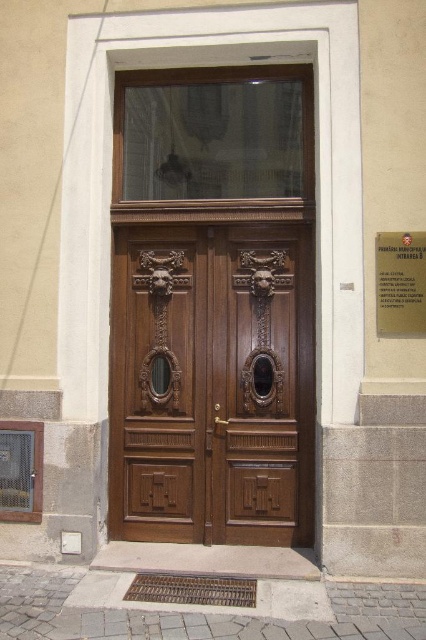
Question: Which point appears farthest from the camera in this image?

Choices:
 (A) (259, 321)
 (B) (416, 244)

Answer: (A)

Question: Does polished wood door at center have a smaller size compared to metallic gold plaque at center?

Choices:
 (A) no
 (B) yes

Answer: (A)

Question: Does polished wood door at center appear on the left side of metallic gold plaque at center?

Choices:
 (A) yes
 (B) no

Answer: (A)

Question: Can you confirm if polished wood door at center is thinner than metallic gold plaque at center?

Choices:
 (A) yes
 (B) no

Answer: (B)

Question: Which point appears farthest from the camera in this image?

Choices:
 (A) (212, 342)
 (B) (414, 236)

Answer: (A)